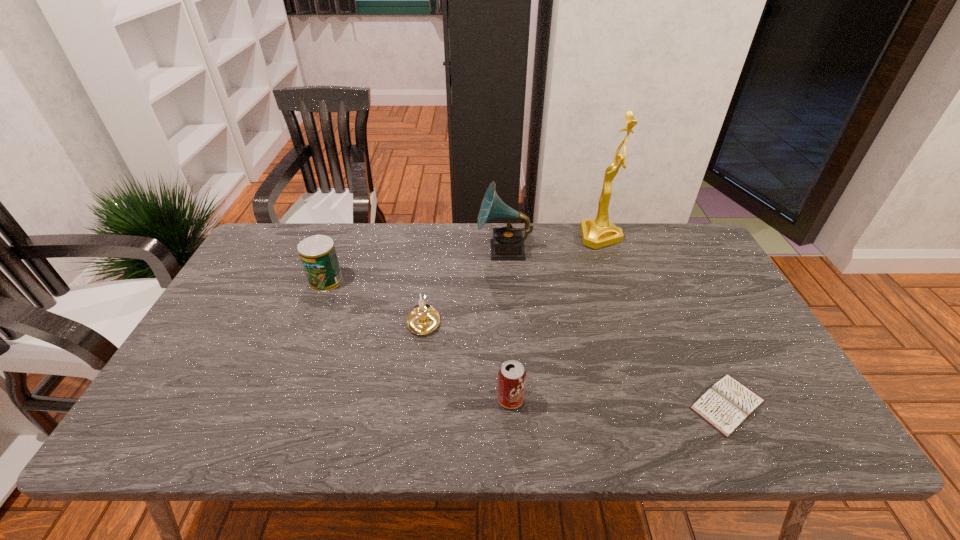
Find the location of `free space between the second tallest object and the can`. free space between the second tallest object and the can is located at coordinates (415, 266).

Identify which object is the closest to the diary. Please provide its 2D coordinates. Your answer should be formatted as a tuple, i.e. [(x, y)], where the tuple contains the x and y coordinates of a point satisfying the conditions above.

[(511, 376)]

This screenshot has width=960, height=540. What are the coordinates of `object that ranks as the second closest to the fourth farthest object` in the screenshot? It's located at (511, 376).

Image resolution: width=960 pixels, height=540 pixels. Find the location of `vacant space that satisfies the following two spatial constraints: 1. on the front-facing side of the award; 2. on the left side of the diary`. vacant space that satisfies the following two spatial constraints: 1. on the front-facing side of the award; 2. on the left side of the diary is located at coordinates (660, 404).

This screenshot has width=960, height=540. In order to click on vacant area in the image that satisfies the following two spatial constraints: 1. on the front-facing side of the tallest object; 2. on the back side of the shortest object in this screenshot , I will do `click(660, 404)`.

Where is `free spot that satisfies the following two spatial constraints: 1. from the horn of the phonograph_record; 2. on the front side of the soda can`? The image size is (960, 540). free spot that satisfies the following two spatial constraints: 1. from the horn of the phonograph_record; 2. on the front side of the soda can is located at coordinates (515, 399).

I want to click on free point that satisfies the following two spatial constraints: 1. from the horn of the fifth shortest object; 2. on the front side of the can, so click(x=506, y=281).

Image resolution: width=960 pixels, height=540 pixels. Find the location of `vacant space that satisfies the following two spatial constraints: 1. on the front-facing side of the tallest object; 2. on the left side of the shortest object`. vacant space that satisfies the following two spatial constraints: 1. on the front-facing side of the tallest object; 2. on the left side of the shortest object is located at coordinates (660, 404).